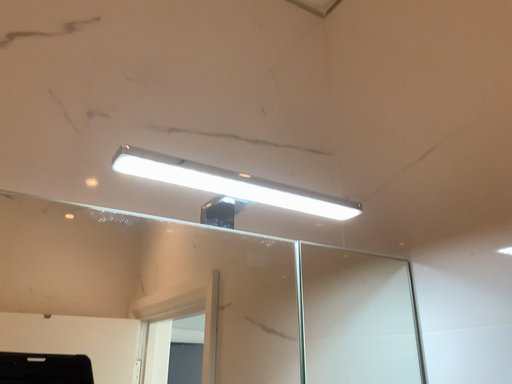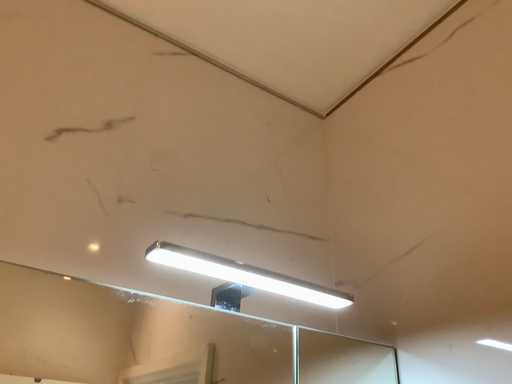
Question: How did the camera likely rotate when shooting the video?

Choices:
 (A) rotated downward
 (B) rotated upward

Answer: (B)